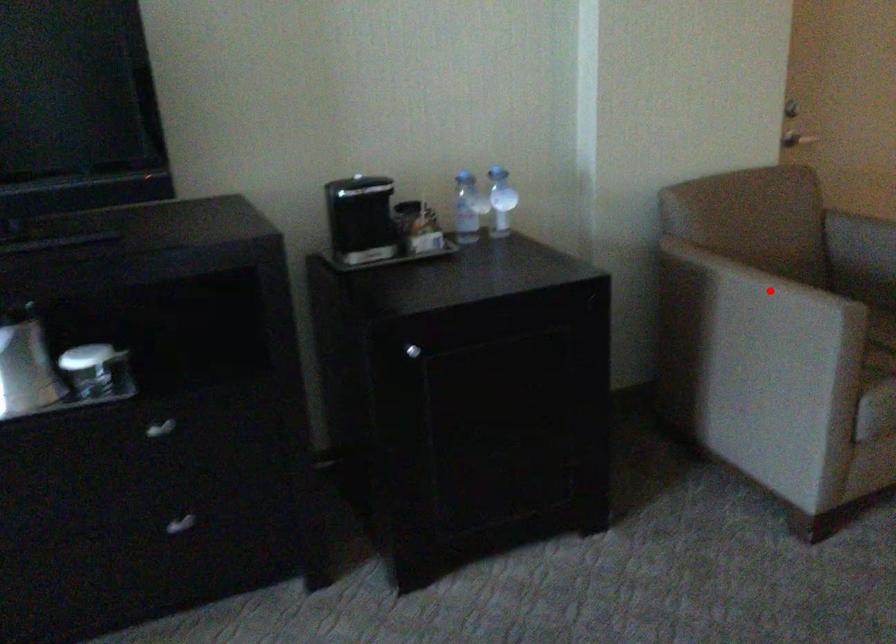
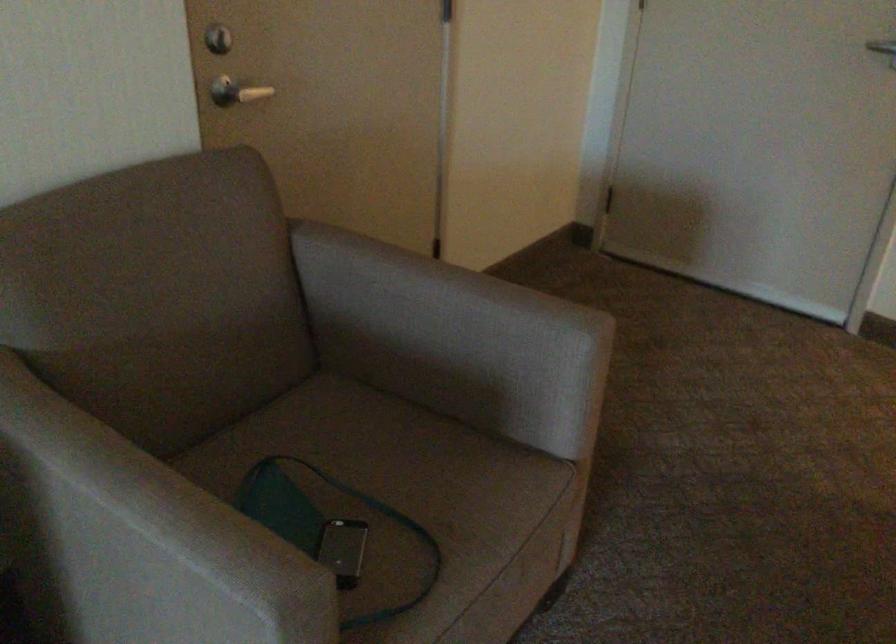
Question: A red point is marked in image1. In image2, is the corresponding 3D point closer to the camera or farther? Reply with the corresponding letter.

Choices:
 (A) The corresponding 3D point is closer.
 (B) The corresponding 3D point is farther.

Answer: (A)